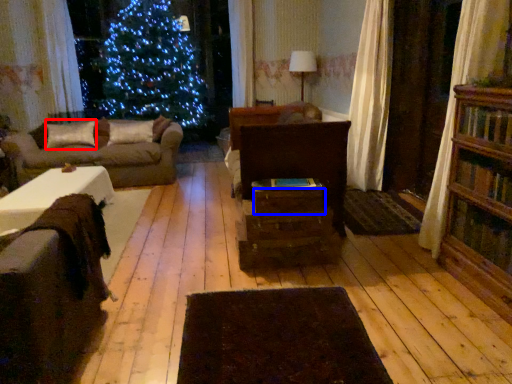
Question: Which object appears closest to the camera in this image, pillow (highlighted by a red box) or drawer (highlighted by a blue box)?

Choices:
 (A) pillow
 (B) drawer

Answer: (B)